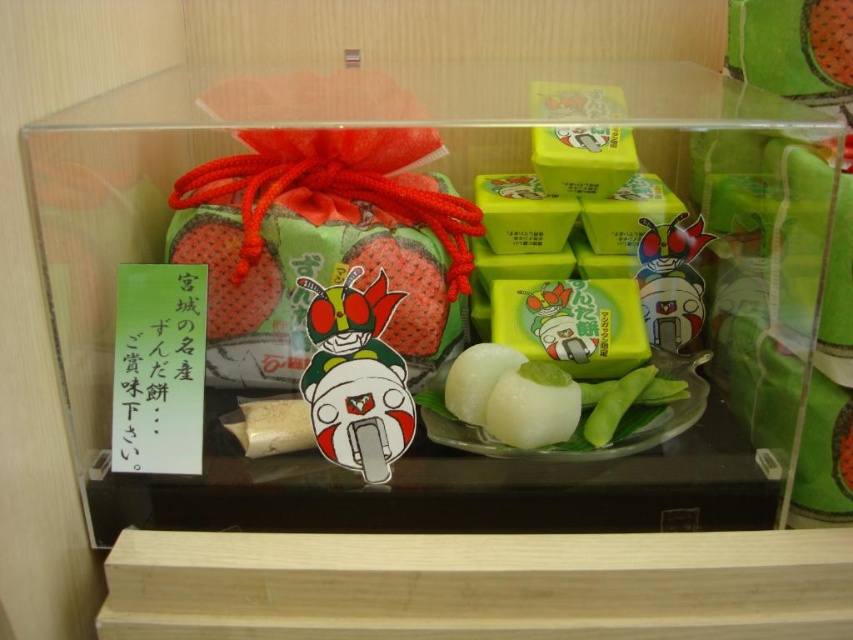
Question: Does transparent plastic box at center have a lesser width compared to matte plastic toy at center?

Choices:
 (A) yes
 (B) no

Answer: (B)

Question: Is matte plastic toy at center thinner than white matte rice cake at center?

Choices:
 (A) no
 (B) yes

Answer: (A)

Question: Among these points, which one is nearest to the camera?

Choices:
 (A) (399, 280)
 (B) (218, 220)
 (C) (648, 140)
 (D) (392, 380)

Answer: (D)

Question: Which object is positioned farthest from the white matte rice cake at center?

Choices:
 (A) transparent plastic box at center
 (B) smooth red strawberry at center
 (C) matte plastic toy at center
 (D) matte green strawberry at center

Answer: (D)

Question: Which is nearer to the transparent plastic box at center?

Choices:
 (A) matte plastic toy at center
 (B) matte green strawberry at center

Answer: (A)

Question: Is transparent plastic box at center further to camera compared to matte plastic toy at center?

Choices:
 (A) yes
 (B) no

Answer: (B)